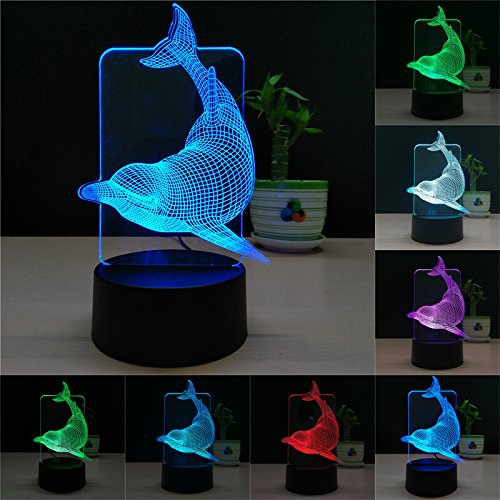
Locate an element on the screen. This screenshot has height=500, width=500. stand is located at coordinates (160, 320).